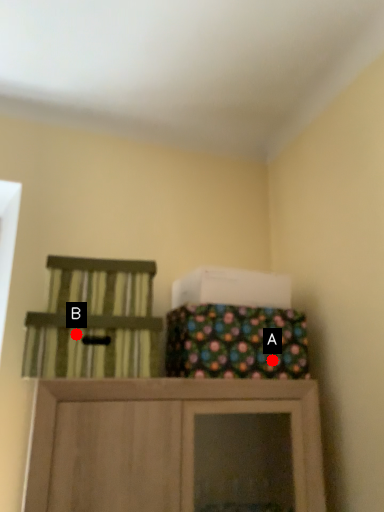
Question: Two points are circled on the image, labeled by A and B beside each circle. Which point is farther from the camera taking this photo?

Choices:
 (A) A is further
 (B) B is further

Answer: (A)